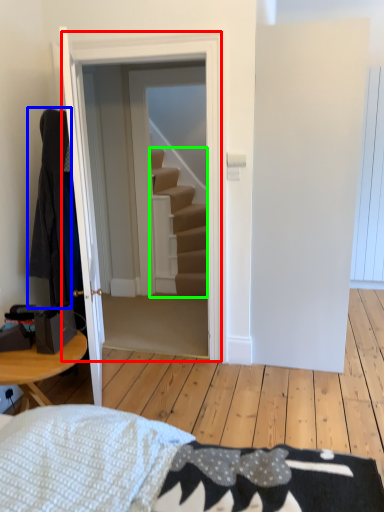
Question: Which is farther away from door (highlighted by a red box)? robe (highlighted by a blue box) or stairs (highlighted by a green box)?

Choices:
 (A) robe
 (B) stairs

Answer: (B)